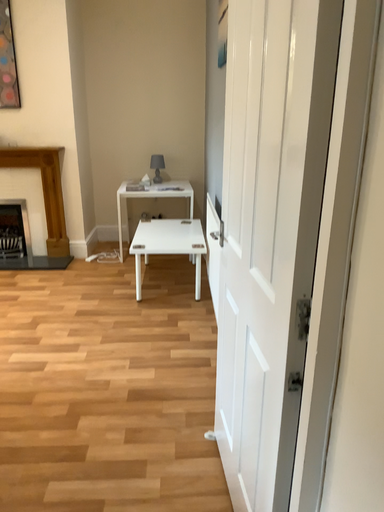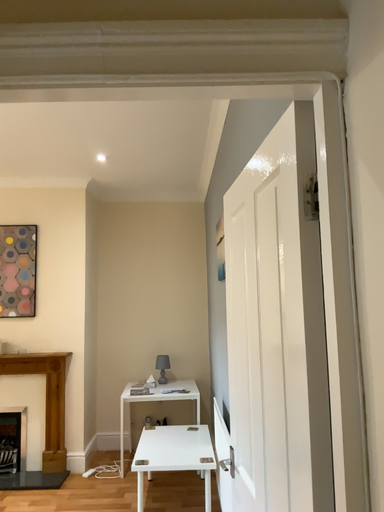
Question: How did the camera likely rotate when shooting the video?

Choices:
 (A) rotated upward
 (B) rotated downward

Answer: (A)